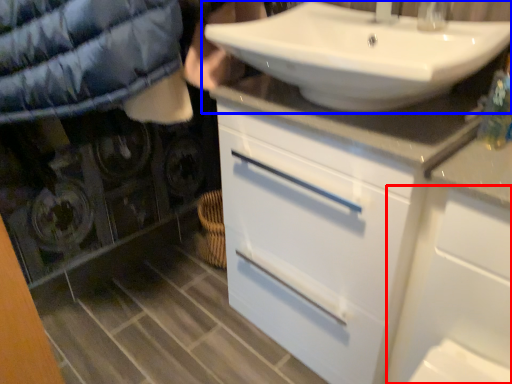
Question: Which object is closer to the camera taking this photo, cabinetry (highlighted by a red box) or sink (highlighted by a blue box)?

Choices:
 (A) cabinetry
 (B) sink

Answer: (A)